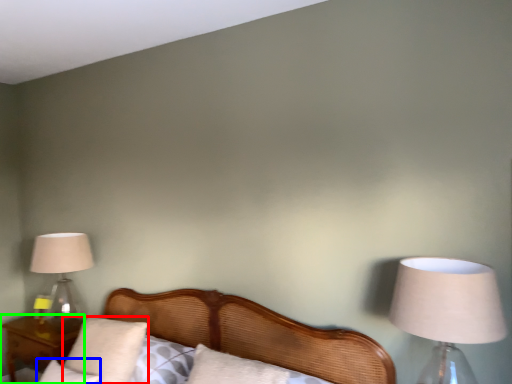
Question: Which object is positioned farthest from pillow (highlighted by a red box)? Select from pillow (highlighted by a blue box) and nightstand (highlighted by a green box).

Choices:
 (A) pillow
 (B) nightstand

Answer: (B)